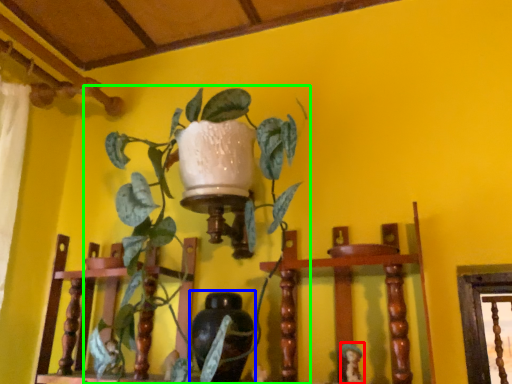
Question: Based on their relative distances, which object is farther from toy (highlighted by a red box)? Choose from vase (highlighted by a blue box) and houseplant (highlighted by a green box).

Choices:
 (A) vase
 (B) houseplant

Answer: (B)